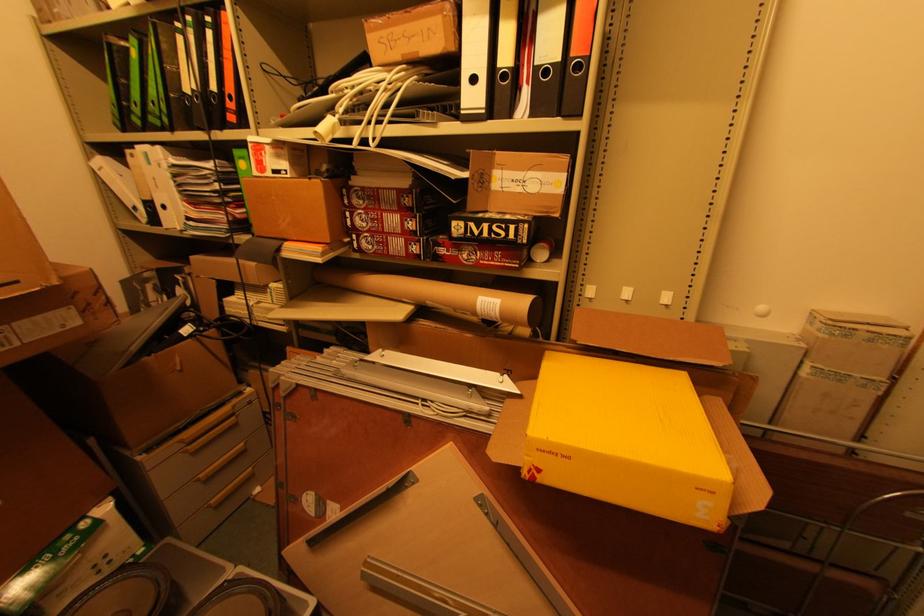
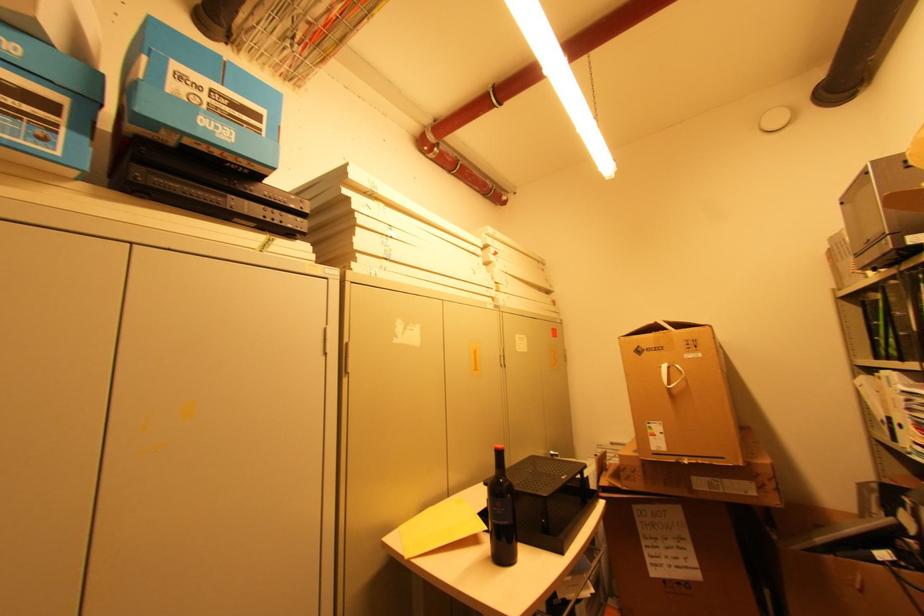
In the second image, find the point that corresponds to (x=131, y=107) in the first image.

(881, 341)